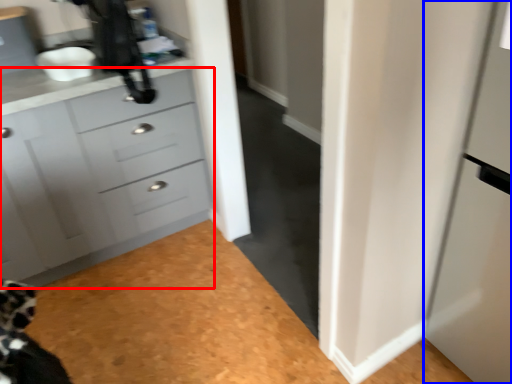
Question: Which object appears farthest to the camera in this image, chest of drawers (highlighted by a red box) or screen door (highlighted by a blue box)?

Choices:
 (A) chest of drawers
 (B) screen door

Answer: (A)